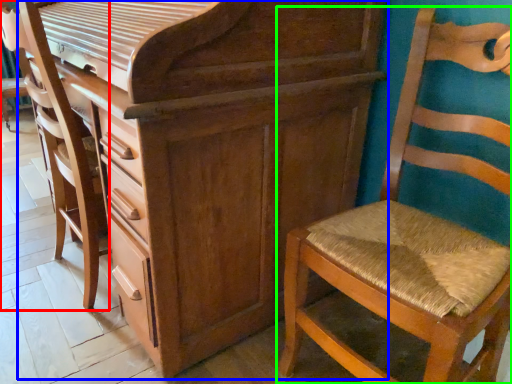
Question: Which object is positioned closest to swivel chair (highlighted by a red box)? Select from chest of drawers (highlighted by a blue box) and chair (highlighted by a green box).

Choices:
 (A) chest of drawers
 (B) chair

Answer: (A)